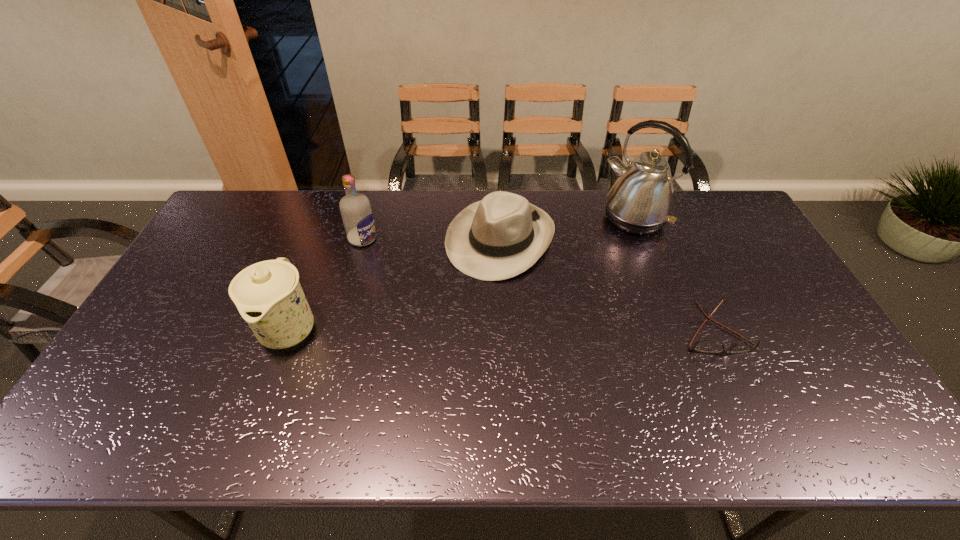
You are a GUI agent. You are given a task and a screenshot of the screen. Output one action in this format:
    pyautogui.click(x=<x>, y=<y>)
    Task: Click on the free spot located on the label of the fourth object from right to left
    
    Given the screenshot: What is the action you would take?
    pyautogui.click(x=447, y=290)

Where is `free location located 0.320m on the label of the fourth object from right to left`? The height and width of the screenshot is (540, 960). free location located 0.320m on the label of the fourth object from right to left is located at coordinates (445, 289).

You are a GUI agent. You are given a task and a screenshot of the screen. Output one action in this format:
    pyautogui.click(x=<x>, y=<y>)
    Task: Click on the vacant region located 0.270m on the label of the fourth object from right to left
    
    Given the screenshot: What is the action you would take?
    pyautogui.click(x=433, y=281)

Locate an element on the screen. vacant region located 0.260m on the front-facing side of the third object from left to right is located at coordinates (436, 340).

Identify the location of free location located on the front-facing side of the third object from left to right. (438, 338).

I want to click on free space located 0.380m on the front-facing side of the third object from left to right, so click(413, 375).

The image size is (960, 540). Identify the location of kettle that is positioned at the far edge. (641, 200).

The image size is (960, 540). Identify the location of vodka that is at the far edge. (355, 208).

This screenshot has height=540, width=960. Find the location of `fedora present at the far edge`. fedora present at the far edge is located at coordinates (501, 236).

What are the coordinates of `vacant space at the far edge` in the screenshot? It's located at (397, 214).